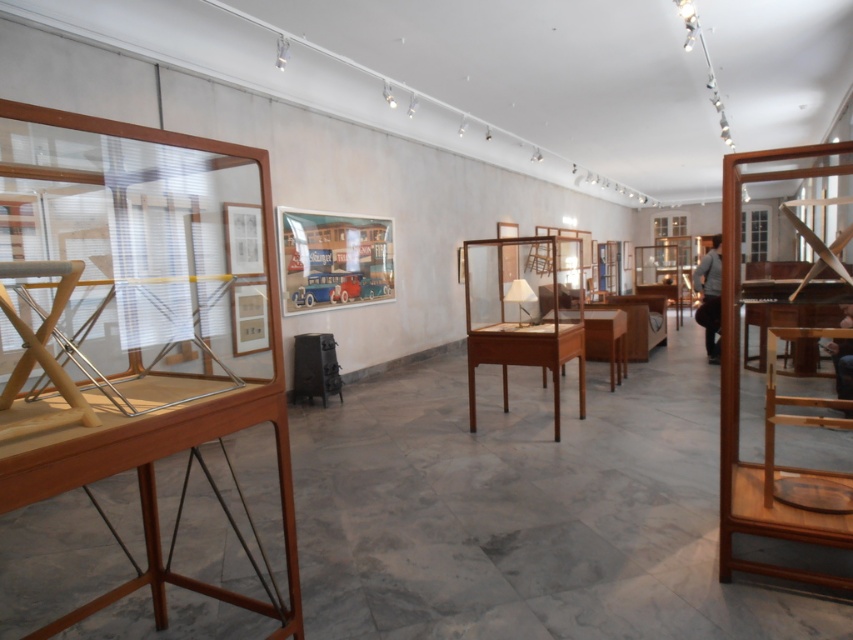
Can you confirm if teak wood folding chair at right is positioned above teak wood cabinet at center?

No, teak wood folding chair at right is not above teak wood cabinet at center.

Consider the image. Between teak wood folding chair at right and teak wood cabinet at center, which one has less height?

With less height is teak wood cabinet at center.

Who is more distant from viewer, (833,474) or (515,259)?

The point (515,259) is behind.

The width and height of the screenshot is (853, 640). Identify the location of teak wood folding chair at right. (738, 392).